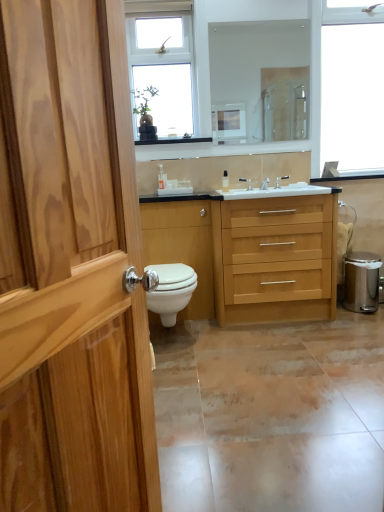
What is the approximate height of clear glass window at upper center, the 1th window in the left-to-right sequence?

It is 97.66 centimeters.

The height and width of the screenshot is (512, 384). Identify the location of silver metallic faucet at center, arranged as the 3th tap when viewed from the right. (246, 182).

This screenshot has width=384, height=512. What do you see at coordinates (324, 78) in the screenshot?
I see `transparent glass window at upper right, arranged as the first window when viewed from the right` at bounding box center [324, 78].

This screenshot has width=384, height=512. What do you see at coordinates (162, 178) in the screenshot?
I see `clear plastic bottle at center, positioned as the second toiletry in right-to-left order` at bounding box center [162, 178].

What do you see at coordinates (280, 180) in the screenshot?
I see `silver metallic faucet at center, the first tap from the right` at bounding box center [280, 180].

Locate an element on the screen. clear glass window at upper center, placed as the second window when sorted from right to left is located at coordinates (163, 72).

Consider the image. Is silver metallic trash can at lower right oriented towards transparent glass window at upper right, arranged as the first window when viewed from the right?

→ No, silver metallic trash can at lower right does not turn towards transparent glass window at upper right, arranged as the first window when viewed from the right.

From a real-world perspective, which object rests below the other?

In real-world perspective, silver metallic trash can at lower right is lower.

Considering the relative positions of silver metallic trash can at lower right and transparent glass window at upper right, arranged as the first window when viewed from the right, in the image provided, is silver metallic trash can at lower right to the left or to the right of transparent glass window at upper right, arranged as the first window when viewed from the right,?

silver metallic trash can at lower right is positioned on transparent glass window at upper right, arranged as the first window when viewed from the right,'s right side.

Based on the photo, from the image's perspective, is silver metallic trash can at lower right under transparent glass window at upper right, placed as the second window when sorted from left to right?

Yes.

From the image's perspective, is clear glass window at upper center, the 1th window in the left-to-right sequence, positioned above or below matte ceramic tile at lower center?

clear glass window at upper center, the 1th window in the left-to-right sequence, is situated higher than matte ceramic tile at lower center in the image.

Based on the photo, between clear glass window at upper center, the 1th window in the left-to-right sequence, and matte ceramic tile at lower center, which one is positioned in front?

matte ceramic tile at lower center is more forward.

Is clear glass window at upper center, the 1th window in the left-to-right sequence, shorter than matte ceramic tile at lower center?

Incorrect, the height of clear glass window at upper center, the 1th window in the left-to-right sequence, does not fall short of that of matte ceramic tile at lower center.

Is clear glass window at upper center, placed as the second window when sorted from right to left, positioned with its back to matte ceramic tile at lower center?

That's not correct — clear glass window at upper center, placed as the second window when sorted from right to left, is not looking away from matte ceramic tile at lower center.

Can you tell me how much clear plastic bottle at center, the 1th toiletry in the left-to-right sequence, and transparent plastic bottle at center, which is the first toiletry in right-to-left order, differ in facing direction?

7.04 degrees separate the facing orientations of clear plastic bottle at center, the 1th toiletry in the left-to-right sequence, and transparent plastic bottle at center, which is the first toiletry in right-to-left order.

Does point (159, 166) come farther from viewer compared to point (225, 185)?

No, it is not.

Does clear plastic bottle at center, the 1th toiletry in the left-to-right sequence, have a lesser height compared to transparent plastic bottle at center, which is the first toiletry in right-to-left order?

Incorrect, the height of clear plastic bottle at center, the 1th toiletry in the left-to-right sequence, does not fall short of that of transparent plastic bottle at center, which is the first toiletry in right-to-left order.

The height and width of the screenshot is (512, 384). Find the location of `toiletry behind the clear plastic bottle at center, positioned as the second toiletry in right-to-left order`. toiletry behind the clear plastic bottle at center, positioned as the second toiletry in right-to-left order is located at coordinates (225, 181).

Is wooden drawer at center aimed at transparent glass window at upper right, placed as the second window when sorted from left to right?

No, wooden drawer at center is not facing towards transparent glass window at upper right, placed as the second window when sorted from left to right.

From the image's perspective, is wooden drawer at center located above or below transparent glass window at upper right, arranged as the first window when viewed from the right?

Based on their image positions, wooden drawer at center is located beneath transparent glass window at upper right, arranged as the first window when viewed from the right.

From the picture: Does wooden drawer at center come in front of transparent glass window at upper right, placed as the second window when sorted from left to right?

Yes, wooden drawer at center is closer to the camera.

From a real-world perspective, which is physically below, wooden drawer at center or transparent glass window at upper right, placed as the second window when sorted from left to right?

wooden drawer at center is physically lower.

From the image's perspective, is white glossy toilet at center positioned above or below white glossy toilet at center?

Clearly, from the image's perspective, white glossy toilet at center is below white glossy toilet at center.

Measure the distance from white glossy toilet at center to white glossy toilet at center.

white glossy toilet at center and white glossy toilet at center are 11.04 inches apart from each other.

Considering the positions of objects white glossy toilet at center and white glossy toilet at center in the image provided, who is more to the left, white glossy toilet at center or white glossy toilet at center?

white glossy toilet at center is more to the left.

Does white glossy toilet at center have a lesser height compared to white glossy toilet at center?

Yes, white glossy toilet at center is shorter than white glossy toilet at center.

From the picture: How different are the orientations of silver metallic faucet at center, acting as the third tap starting from the left, and silver metallic faucet at center, arranged as the second tap when viewed from the right, in degrees?

The facing directions of silver metallic faucet at center, acting as the third tap starting from the left, and silver metallic faucet at center, arranged as the second tap when viewed from the right, are 0.000361 degrees apart.

Does point (277, 187) appear closer or farther from the camera than point (263, 188)?

Point (277, 187).

Is silver metallic faucet at center, acting as the third tap starting from the left, wider or thinner than silver metallic faucet at center, arranged as the second tap when viewed from the right?

silver metallic faucet at center, acting as the third tap starting from the left, is thinner than silver metallic faucet at center, arranged as the second tap when viewed from the right.

Considering the positions of objects silver metallic faucet at center, acting as the third tap starting from the left, and silver metallic faucet at center, arranged as the second tap when viewed from the right, in the image provided, who is more to the left, silver metallic faucet at center, acting as the third tap starting from the left, or silver metallic faucet at center, arranged as the second tap when viewed from the right,?

silver metallic faucet at center, arranged as the second tap when viewed from the right, is more to the left.

From the image's perspective, which one is positioned lower, white glossy toilet at center or matte ceramic tile at lower center?

From the image's view, matte ceramic tile at lower center is below.

How many degrees apart are the facing directions of white glossy toilet at center and matte ceramic tile at lower center?

There is a 0.292-degree angle between the facing directions of white glossy toilet at center and matte ceramic tile at lower center.

You are a GUI agent. You are given a task and a screenshot of the screen. Output one action in this format:
    pyautogui.click(x=<x>, y=<y>)
    Task: Click on the ceramic tile below the white glossy toilet at center (from the image's perspective)
    The width and height of the screenshot is (384, 512).
    Given the screenshot: What is the action you would take?
    pyautogui.click(x=271, y=415)

From a real-world perspective, is white glossy toilet at center physically located above or below matte ceramic tile at lower center?

From a real-world perspective, white glossy toilet at center is physically above matte ceramic tile at lower center.

Where is `the 1st window in front of the silver metallic trash can at lower right`? This screenshot has width=384, height=512. the 1st window in front of the silver metallic trash can at lower right is located at coordinates (324, 78).

The height and width of the screenshot is (512, 384). There is a matte ceramic tile at lower center. What are the coordinates of `the 2nd window above it (from a real-world perspective)` in the screenshot? It's located at (163, 72).

Based on their spatial positions, is transparent plastic bottle at center, which is the first toiletry in right-to-left order, or silver metallic trash can at lower right further from white glossy toilet at center?

The object further to white glossy toilet at center is silver metallic trash can at lower right.

Estimate the real-world distances between objects in this image. Which object is closer to silver metallic trash can at lower right, clear plastic bottle at center, positioned as the second toiletry in right-to-left order, or white glossy toilet at center?

white glossy toilet at center is closer to silver metallic trash can at lower right.

From the image, which object appears to be nearer to white glossy toilet at center, white glossy toilet at center or clear glass mirror at upper center?

white glossy toilet at center is closer to white glossy toilet at center.

When comparing their distances from clear plastic bottle at center, the 1th toiletry in the left-to-right sequence, does wooden drawer at center or light wood/woodenobject at center seem further?

light wood/woodenobject at center is further to clear plastic bottle at center, the 1th toiletry in the left-to-right sequence.

Based on their spatial positions, is white glossy toilet at center or transparent glass window at upper right, placed as the second window when sorted from left to right, closer to matte ceramic tile at lower center?

white glossy toilet at center is positioned closer to the anchor matte ceramic tile at lower center.

Estimate the real-world distances between objects in this image. Which object is closer to transparent plastic bottle at center, the 2th toiletry viewed from the left, transparent glass window at upper right, arranged as the first window when viewed from the right, or silver metallic faucet at center, the first tap from the right?

Based on the image, silver metallic faucet at center, the first tap from the right, appears to be nearer to transparent plastic bottle at center, the 2th toiletry viewed from the left.

From the image, which object appears to be nearer to silver metallic faucet at center, positioned as the first tap in left-to-right order, clear glass window at upper center, placed as the second window when sorted from right to left, or wooden drawer at center?

wooden drawer at center.

Based on the photo, from the image, which object appears to be nearer to white glossy toilet at center, wooden drawer at center or clear glass window at upper center, placed as the second window when sorted from right to left?

wooden drawer at center is closer to white glossy toilet at center.

Where is `drawer between silver metallic faucet at center, arranged as the 3th tap when viewed from the right, and light wood/woodenobject at center in the up-down direction`? drawer between silver metallic faucet at center, arranged as the 3th tap when viewed from the right, and light wood/woodenobject at center in the up-down direction is located at coordinates (276, 211).

Locate an element on the screen. The image size is (384, 512). cabinetry located between matte ceramic tile at lower center and silver metallic faucet at center, marked as the 2th tap in a left-to-right arrangement, in the depth direction is located at coordinates (182, 246).

Identify the location of drawer between silver metallic faucet at center, marked as the 2th tap in a left-to-right arrangement, and silver metallic trash can at lower right. (276, 211).

Locate an element on the screen. Image resolution: width=384 pixels, height=512 pixels. drawer between silver metallic faucet at center, arranged as the 3th tap when viewed from the right, and silver metallic trash can at lower right, in the horizontal direction is located at coordinates (276, 211).